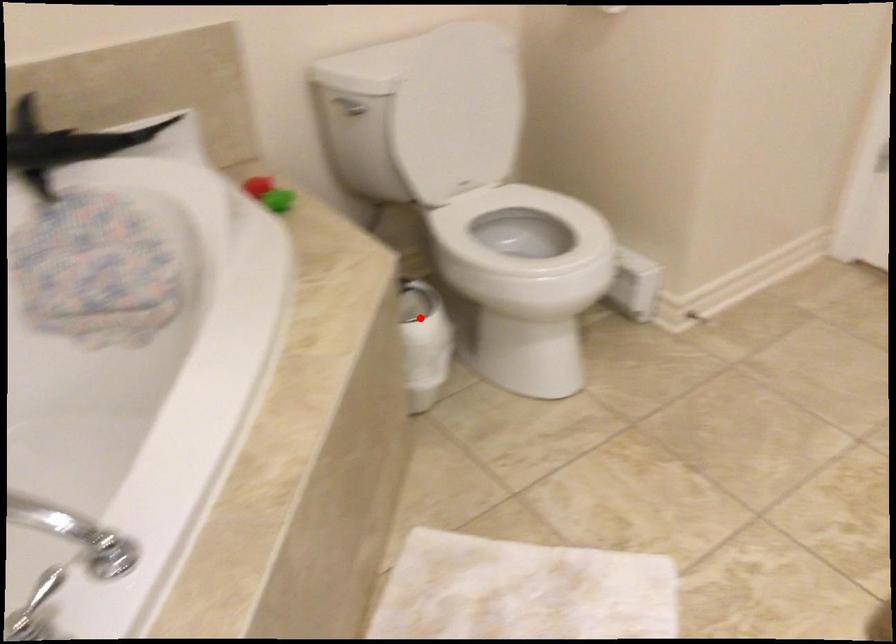
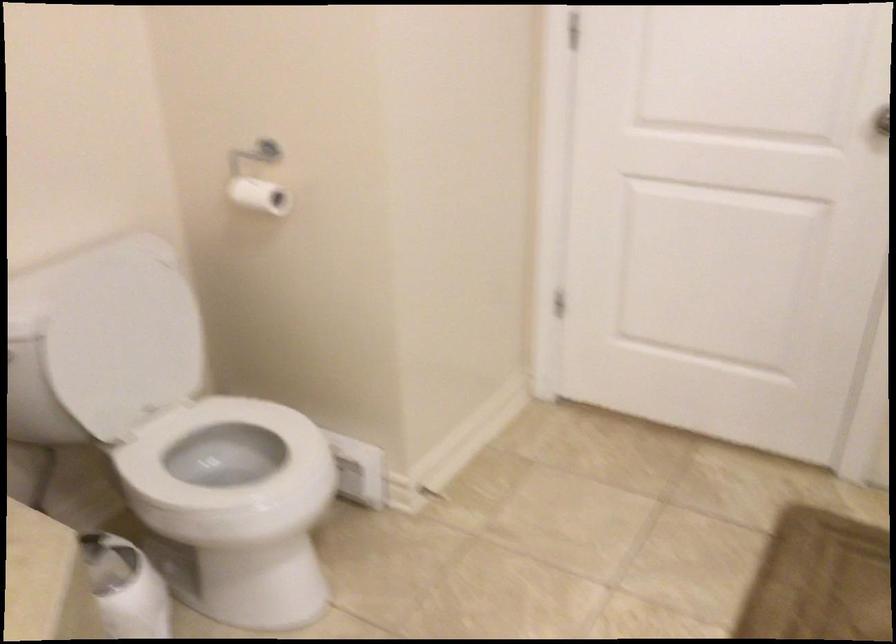
Question: I am providing you with two images of the same scene from different viewpoints. In image1, a red point is highlighted. Considering the same 3D point in image2, which of the following is correct?

Choices:
 (A) It is closer
 (B) It is farther

Answer: (A)